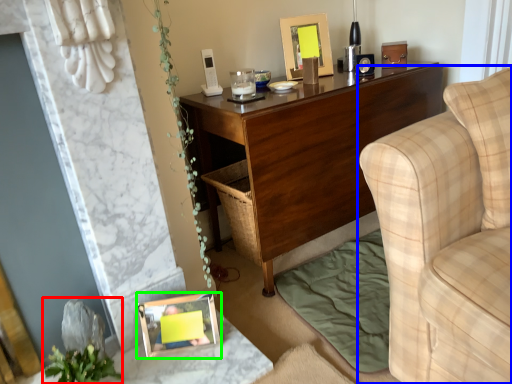
Question: Based on their relative distances, which object is nearer to plant (highlighted by a red box)? Choose from studio couch (highlighted by a blue box) and picture frame (highlighted by a green box).

Choices:
 (A) studio couch
 (B) picture frame

Answer: (B)